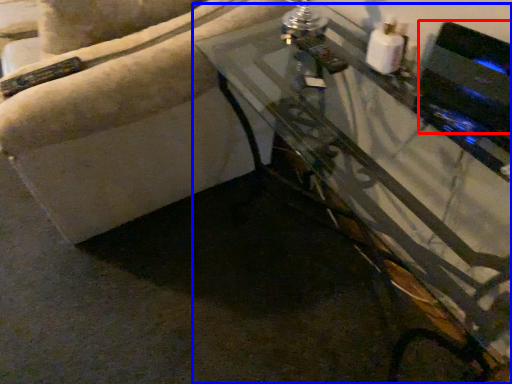
Question: Among these objects, which one is nearest to the camera, appliance (highlighted by a red box) or table (highlighted by a blue box)?

Choices:
 (A) appliance
 (B) table

Answer: (B)